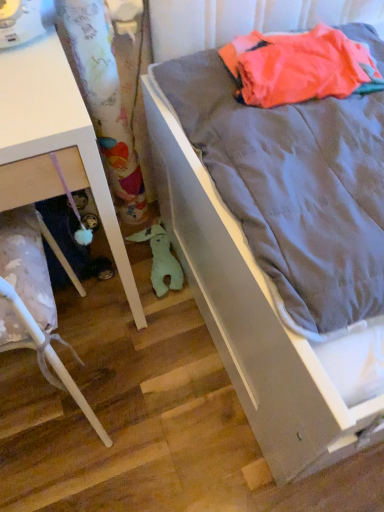
Where is `free space above wooden floor at lower left (from a real-world perspective)`? The height and width of the screenshot is (512, 384). free space above wooden floor at lower left (from a real-world perspective) is located at coordinates (142, 385).